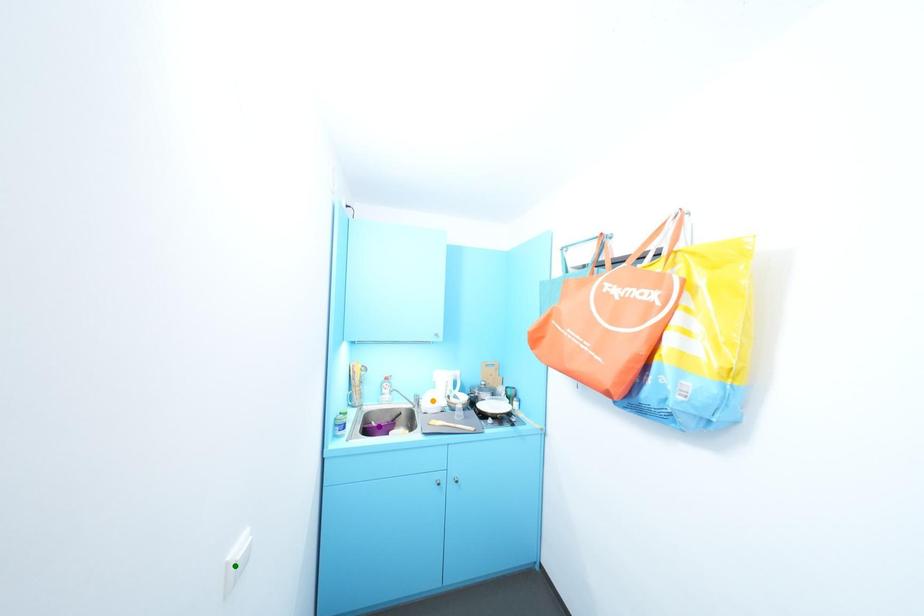
Order these from nearest to farthest:
- green point
- purple point
- orange point

green point < orange point < purple point